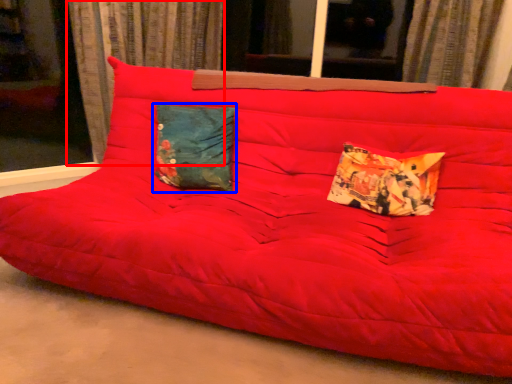
Question: Which object appears farthest to the camera in this image, curtain (highlighted by a red box) or pillow (highlighted by a blue box)?

Choices:
 (A) curtain
 (B) pillow

Answer: (A)